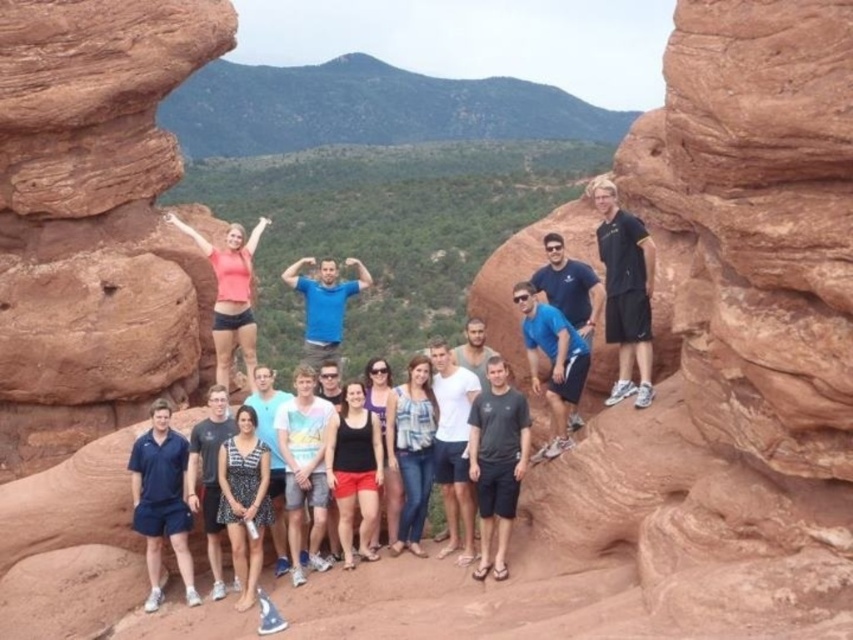
Can you confirm if reddish-brown sandstone at center-right is positioned above dark gray t-shirt at center?

Correct, reddish-brown sandstone at center-right is located above dark gray t-shirt at center.

Find the location of `reddish-brown sandstone at center-right`. reddish-brown sandstone at center-right is located at coordinates (728, 344).

Identify the location of reddish-brown sandstone at center-right. The width and height of the screenshot is (853, 640). (728, 344).

Which is behind, point (91, 228) or point (537, 456)?

Positioned behind is point (91, 228).

Between point (57, 596) and point (567, 376), which one is positioned in front?

Point (57, 596)

You are a GUI agent. You are given a task and a screenshot of the screen. Output one action in this format:
    pyautogui.click(x=<x>, y=<y>)
    Task: Click on the smooth sandstone rock at upper left
    
    Given the screenshot: What is the action you would take?
    pyautogui.click(x=88, y=289)

Is point (157, 515) farther from viewer compared to point (598, 301)?

No, it is in front of (598, 301).

Does blue fabric shorts at lower left have a larger size compared to blue fabric shirt at center?

Incorrect, blue fabric shorts at lower left is not larger than blue fabric shirt at center.

Is point (165, 522) behind point (548, 273)?

No, it is in front of (548, 273).

Identify the location of blue fabric shorts at lower left. (161, 500).